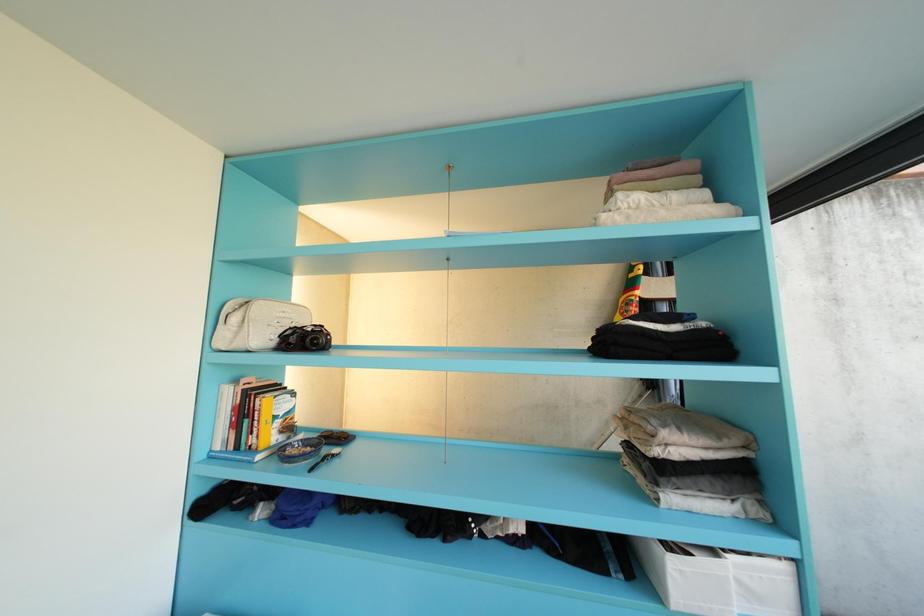
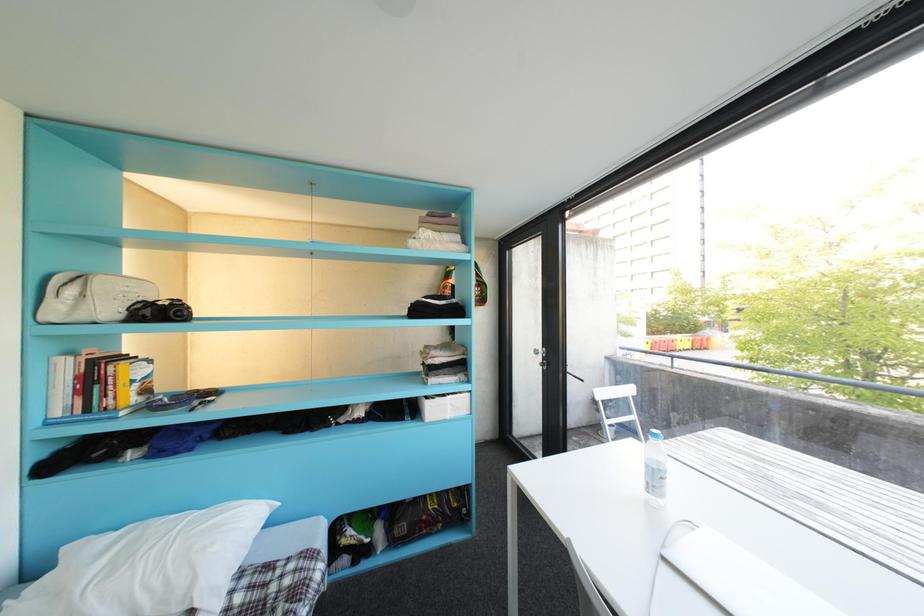
Question: The images are taken continuously from a first-person perspective. In which direction are you moving?

Choices:
 (A) Left
 (B) Right
 (C) Forward
 (D) Backward

Answer: (D)